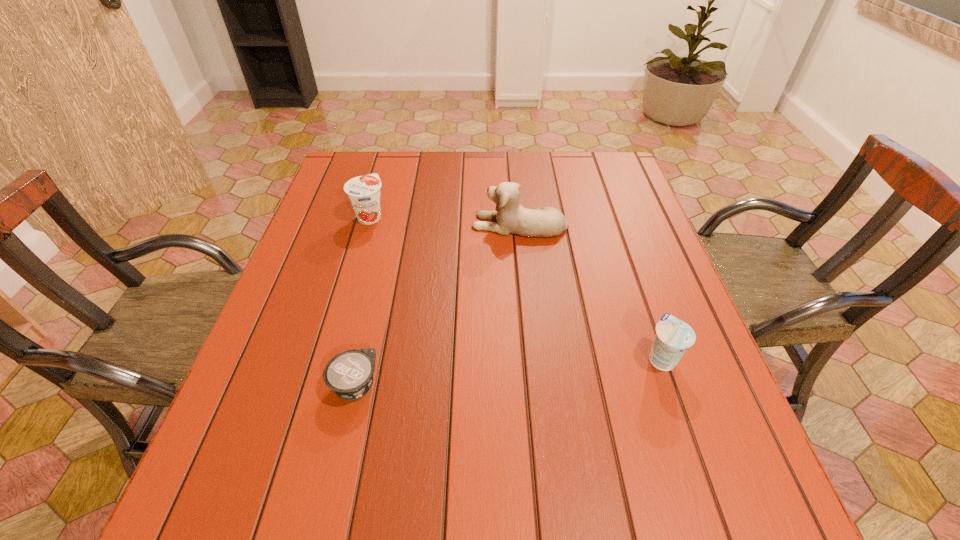
You are a GUI agent. You are given a task and a screenshot of the screen. Output one action in this format:
    pyautogui.click(x=<x>, y=<y>)
    Task: Click on the third closest object relative to the puppy
    This screenshot has width=960, height=540.
    Given the screenshot: What is the action you would take?
    pyautogui.click(x=349, y=374)

This screenshot has width=960, height=540. I want to click on yogurt that is the closest to the tallest object, so click(364, 191).

Where is `yogurt that can be found as the second closest to the farthest yogurt`? This screenshot has height=540, width=960. yogurt that can be found as the second closest to the farthest yogurt is located at coordinates (673, 337).

This screenshot has width=960, height=540. I want to click on free space that satisfies the following two spatial constraints: 1. on the back side of the shortest object; 2. on the left side of the rightmost object, so click(x=361, y=358).

You are a GUI agent. You are given a task and a screenshot of the screen. Output one action in this format:
    pyautogui.click(x=<x>, y=<y>)
    Task: Click on the free location that satisfies the following two spatial constraints: 1. on the back side of the shortest object; 2. on the right side of the rightmost yogurt
    Image resolution: width=960 pixels, height=540 pixels.
    Given the screenshot: What is the action you would take?
    pyautogui.click(x=361, y=358)

At what (x,y) coordinates should I click in order to perform the action: click on blank space that satisfies the following two spatial constraints: 1. on the front-facing side of the tallest object; 2. on the right side of the rightmost object. Please return your answer as a coordinate pair (x, y). The image size is (960, 540). Looking at the image, I should click on (533, 358).

I want to click on free spot that satisfies the following two spatial constraints: 1. on the front-facing side of the second object from right to left; 2. on the front side of the shortest object, so pos(536,385).

The height and width of the screenshot is (540, 960). I want to click on free location that satisfies the following two spatial constraints: 1. on the back side of the rightmost object; 2. on the right side of the shortest object, so click(361, 358).

Locate an element on the screen. This screenshot has width=960, height=540. free space in the image that satisfies the following two spatial constraints: 1. on the front-facing side of the tallest object; 2. on the front side of the shortest object is located at coordinates (536, 385).